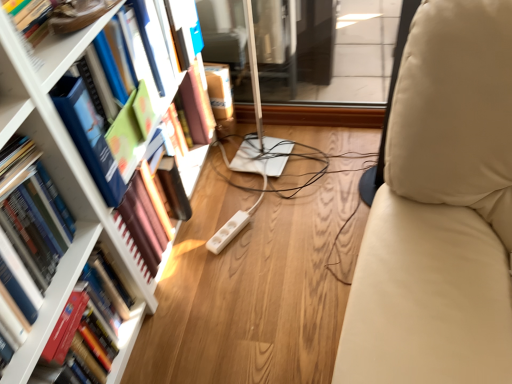
Question: Is hardcover book at left, the third book from the bottom, inside the boundaries of hardcover book at left, the 3th book in the top-to-bottom sequence, or outside?

Choices:
 (A) inside
 (B) outside

Answer: (B)

Question: Considering the positions of hardcover book at left, the first book viewed from the top, and hardcover book at left, positioned as the 1th book in bottom-to-top order, in the image, is hardcover book at left, the first book viewed from the top, wider or thinner than hardcover book at left, positioned as the 1th book in bottom-to-top order,?

Choices:
 (A) wide
 (B) thin

Answer: (B)

Question: Which is farther from the hardcover book at left, arranged as the second book when ordered from the bottom?

Choices:
 (A) hardcover book at left, the 3th book in the top-to-bottom sequence
 (B) white glossy bookshelf at upper left
 (C) hardcover book at left, the first book viewed from the top

Answer: (B)

Question: Which object is the farthest from the hardcover book at left, positioned as the 1th book in bottom-to-top order?

Choices:
 (A) hardcover book at left, which is the second book in top-to-bottom order
 (B) hardcover book at left, the third book from the bottom
 (C) white glossy bookshelf at upper left

Answer: (C)